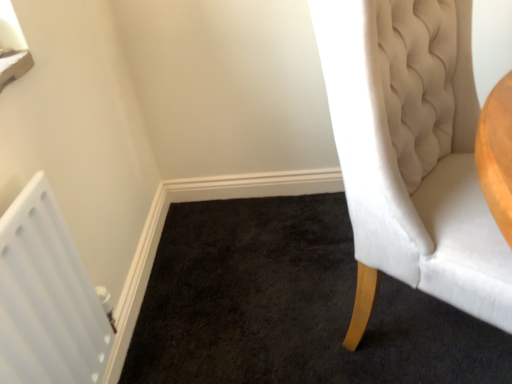
At what (x,y) coordinates should I click in order to perform the action: click on white plastic radiator at lower left. Please return your answer as a coordinate pair (x, y). This screenshot has width=512, height=384. Looking at the image, I should click on (47, 297).

What is the approximate height of white plastic radiator at lower left?

The height of white plastic radiator at lower left is 22.00 inches.

What do you see at coordinates (47, 297) in the screenshot? Image resolution: width=512 pixels, height=384 pixels. I see `white plastic radiator at lower left` at bounding box center [47, 297].

In order to face white velvet chair at right, should I rotate leftwards or rightwards?

To face it directly, rotate right by 25.023 degrees.

Describe the element at coordinates (412, 153) in the screenshot. I see `white velvet chair at right` at that location.

The height and width of the screenshot is (384, 512). Find the location of `white velvet chair at right`. white velvet chair at right is located at coordinates (412, 153).

At what (x,y) coordinates should I click in order to perform the action: click on white plastic radiator at lower left. Please return your answer as a coordinate pair (x, y). Looking at the image, I should click on (47, 297).

Considering the relative positions of white plastic radiator at lower left and white velvet chair at right in the image provided, is white plastic radiator at lower left to the left of white velvet chair at right from the viewer's perspective?

Yes.

Which object is further away from the camera taking this photo, white plastic radiator at lower left or white velvet chair at right?

white plastic radiator at lower left.

Does point (73, 333) lie in front of point (434, 180)?

Yes, point (73, 333) is closer to viewer.

From the image's perspective, who appears lower, white plastic radiator at lower left or white velvet chair at right?

white plastic radiator at lower left appears lower in the image.

From a real-world perspective, is white plastic radiator at lower left physically located above or below white velvet chair at right?

In terms of real-world spatial position, white plastic radiator at lower left is below white velvet chair at right.

Which of these two, white plastic radiator at lower left or white velvet chair at right, is wider?

white velvet chair at right.

Who is taller, white plastic radiator at lower left or white velvet chair at right?

white velvet chair at right.

Considering the relative sizes of white plastic radiator at lower left and white velvet chair at right in the image provided, is white plastic radiator at lower left bigger than white velvet chair at right?

No.

Is white plastic radiator at lower left completely or partially outside of white velvet chair at right?

That's correct, white plastic radiator at lower left is outside of white velvet chair at right.

Is white plastic radiator at lower left far from white velvet chair at right?

They are positioned close to each other.

Looking at this image, could you tell me if white plastic radiator at lower left is turned towards white velvet chair at right?

Yes, white plastic radiator at lower left is facing white velvet chair at right.

In the scene shown: Can you tell me how much white plastic radiator at lower left and white velvet chair at right differ in facing direction?

38 degrees separate the facing orientations of white plastic radiator at lower left and white velvet chair at right.

What are the coordinates of `chair in front of the white plastic radiator at lower left` in the screenshot? It's located at (412, 153).

Considering the relative positions of white velvet chair at right and white plastic radiator at lower left in the image provided, is white velvet chair at right to the left or to the right of white plastic radiator at lower left?

white velvet chair at right is positioned on white plastic radiator at lower left's right side.

Is white velvet chair at right behind white plastic radiator at lower left?

No, the depth of white velvet chair at right is less than that of white plastic radiator at lower left.

Considering the positions of point (420, 13) and point (54, 362), is point (420, 13) closer or farther from the camera than point (54, 362)?

Point (420, 13) is farther from the camera than point (54, 362).

Based on the photo, from the image's perspective, is white velvet chair at right located above or below white plastic radiator at lower left?

From the image's perspective, white velvet chair at right appears above white plastic radiator at lower left.

From a real-world perspective, is white velvet chair at right positioned above or below white plastic radiator at lower left?

white velvet chair at right is above white plastic radiator at lower left.

Does white velvet chair at right have a greater width compared to white plastic radiator at lower left?

Yes, white velvet chair at right is wider than white plastic radiator at lower left.

In terms of height, does white velvet chair at right look taller or shorter compared to white plastic radiator at lower left?

Considering their sizes, white velvet chair at right has more height than white plastic radiator at lower left.

Between white velvet chair at right and white plastic radiator at lower left, which one has larger size?

Bigger between the two is white velvet chair at right.

Is white velvet chair at right situated inside white plastic radiator at lower left or outside?

white velvet chair at right cannot be found inside white plastic radiator at lower left.

Is white velvet chair at right beside white plastic radiator at lower left?

white velvet chair at right and white plastic radiator at lower left are not in contact.

Is white velvet chair at right aimed at white plastic radiator at lower left?

No, white velvet chair at right does not turn towards white plastic radiator at lower left.

How many degrees apart are the facing directions of white velvet chair at right and white plastic radiator at lower left?

They differ by 38 degrees in their facing directions.

This screenshot has height=384, width=512. What are the coordinates of `radiator that appears below the white velvet chair at right (from a real-world perspective)` in the screenshot? It's located at (47, 297).

Image resolution: width=512 pixels, height=384 pixels. I want to click on chair that appears above the white plastic radiator at lower left (from a real-world perspective), so click(x=412, y=153).

Where is `radiator on the left of the white velvet chair at right`? radiator on the left of the white velvet chair at right is located at coordinates (47, 297).